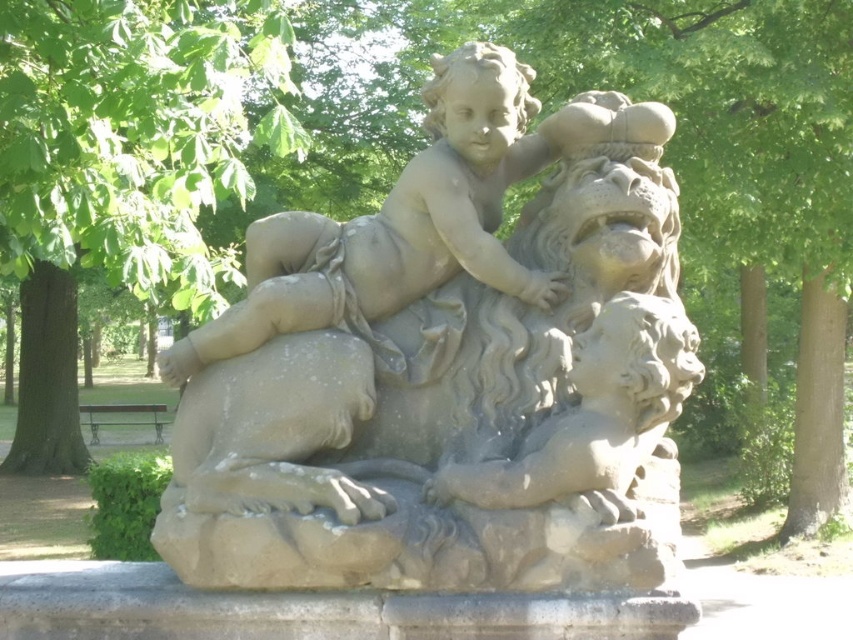
In the scene shown: Who is more forward, (596, 419) or (45, 296)?

Point (596, 419) is more forward.

Is the position of gray stone statue at center less distant than that of green leafy tree at upper left?

That is True.

At what (x,y) coordinates should I click in order to perform the action: click on gray stone statue at center. Please return your answer as a coordinate pair (x, y). The width and height of the screenshot is (853, 640). Looking at the image, I should click on (454, 369).